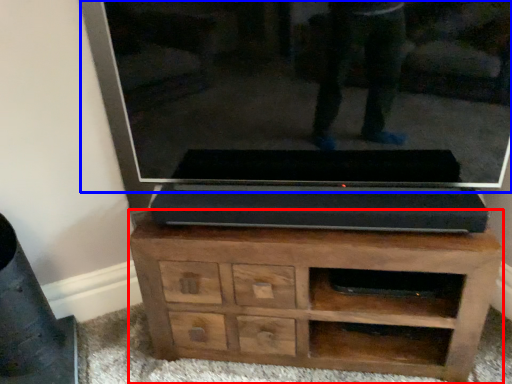
Question: Which object is closer to the camera taking this photo, chest of drawers (highlighted by a red box) or glass door (highlighted by a blue box)?

Choices:
 (A) chest of drawers
 (B) glass door

Answer: (B)